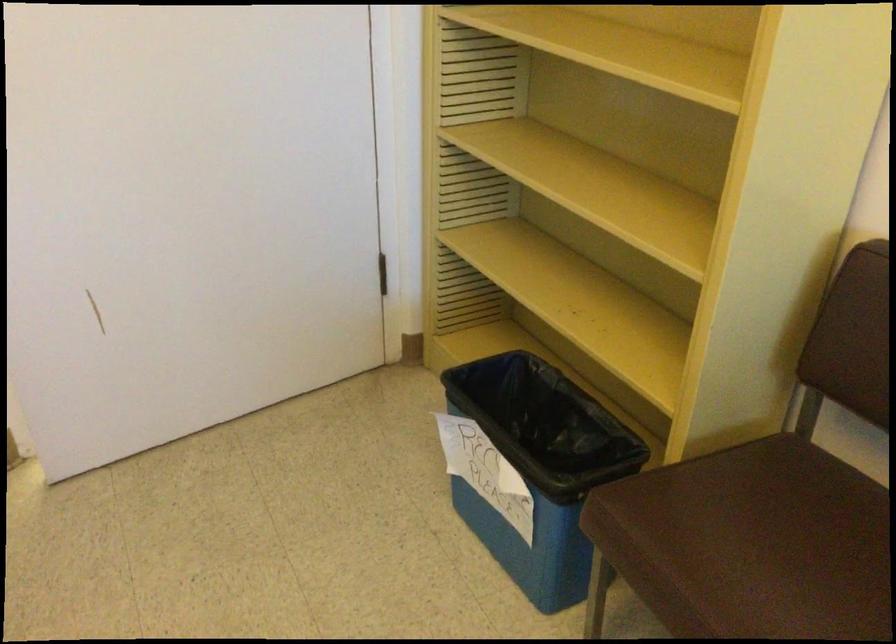
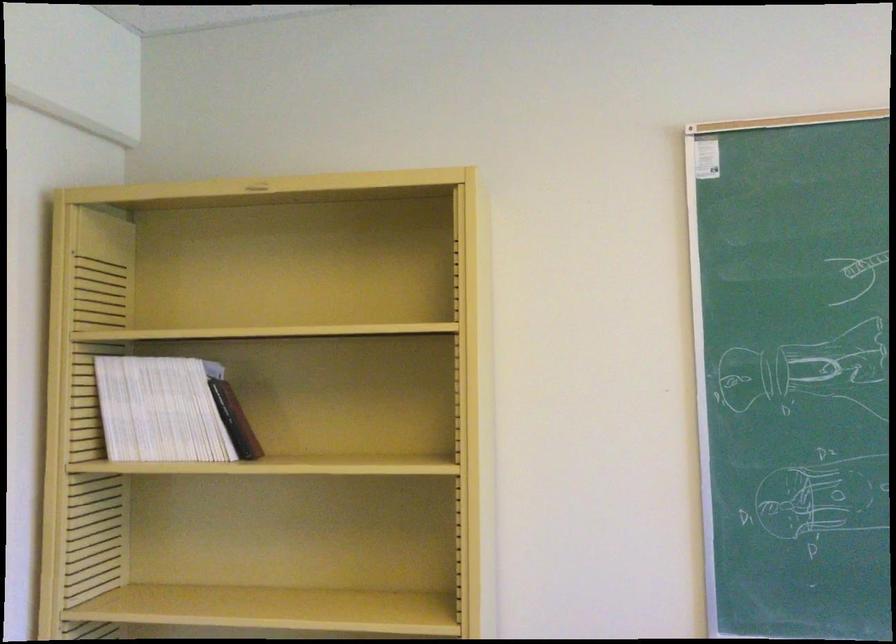
How did the camera likely rotate?

The camera rotated toward right-up.